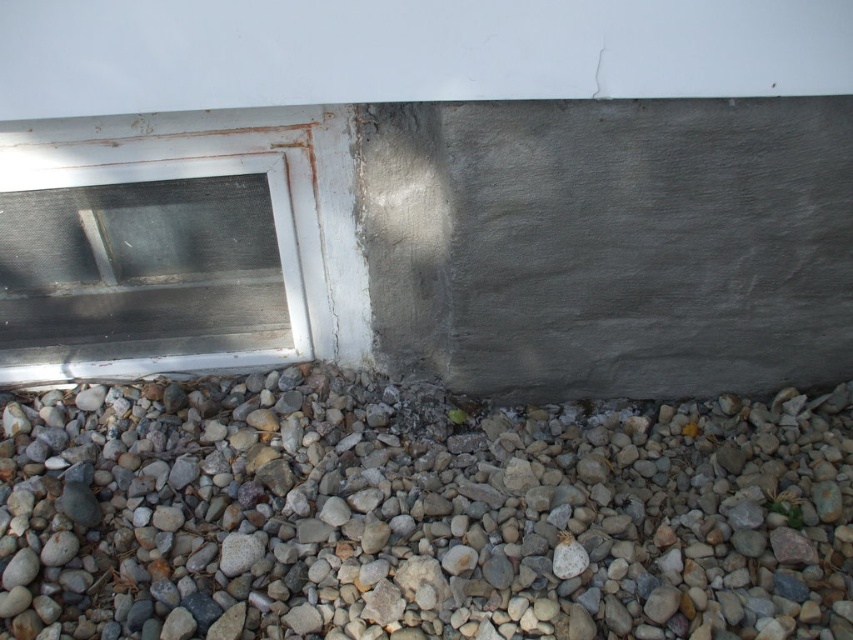
You are a maintenance worker holding a 12 inch measuring tape. You need to check the distance between the gray gravel at lower center and the white plastic window at lower left. Can you reach both points with your tape measure at the same time?

The gray gravel at lower center is 17.15 inches away from the white plastic window at lower left. Since the measuring tape is 12 inches long, it is not long enough to measure the distance between them at the same time.

You are a maintenance worker inspecting the building exterior. You see the gray gravel at lower center and the white plastic window at lower left. Which object is located to the right of the other?

The gray gravel at lower center is positioned on the right side of the white plastic window at lower left, so the gray gravel at lower center is to the right of the white plastic window at lower left.

You are standing at the corner of the building where the wall meets the ground. You need to place a small potted plant exactly at the center of the gray gravel at lower center. According to the image, what are the coordinates where you should place the plant?

The coordinates for the gray gravel at lower center are at point (418,515), so you should place the plant at those coordinates.